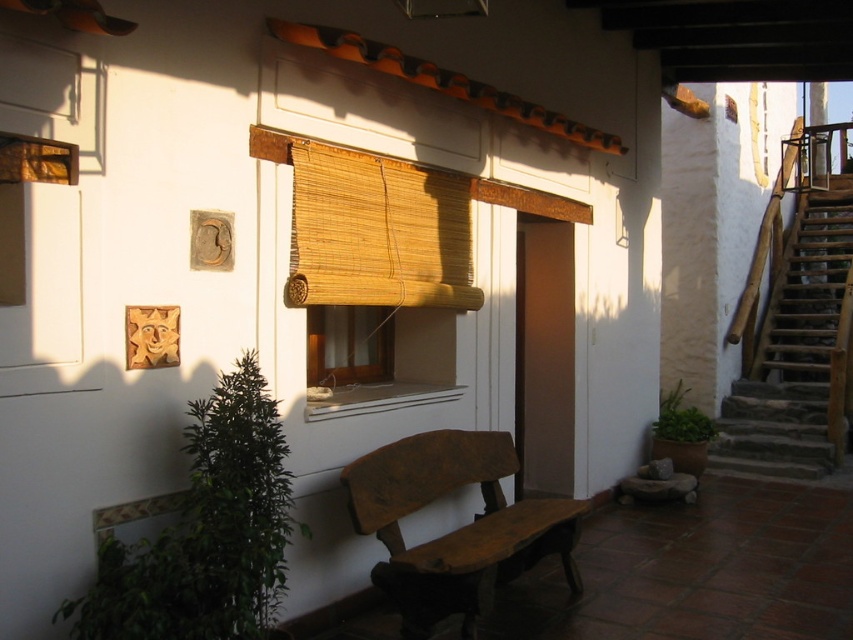
Does wooden stairs at right have a lesser width compared to bamboo mat at center?

In fact, wooden stairs at right might be wider than bamboo mat at center.

Can you confirm if wooden stairs at right is positioned to the right of bamboo mat at center?

Indeed, wooden stairs at right is positioned on the right side of bamboo mat at center.

Find the location of a particular element. The image size is (853, 640). wooden stairs at right is located at coordinates (798, 353).

In the scene shown: Who is positioned more to the left, green leafy plant at lower left or bamboo mat at center?

green leafy plant at lower left

Can you confirm if green leafy plant at lower left is smaller than bamboo mat at center?

Correct, green leafy plant at lower left occupies less space than bamboo mat at center.

I want to click on green leafy plant at lower left, so click(x=206, y=532).

Who is taller, dark brown wooden bench at center or wooden stairs at right?

With more height is wooden stairs at right.

Which is below, dark brown wooden bench at center or wooden stairs at right?

dark brown wooden bench at center is below.

Is point (440, 592) positioned before point (799, 360)?

Yes, point (440, 592) is closer to viewer.

I want to click on dark brown wooden bench at center, so 456,529.